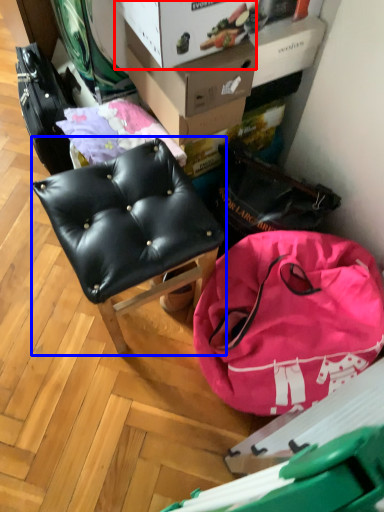
Question: Which point is further to the camera, cardboard box (highlighted by a red box) or chair (highlighted by a blue box)?

Choices:
 (A) cardboard box
 (B) chair

Answer: (A)